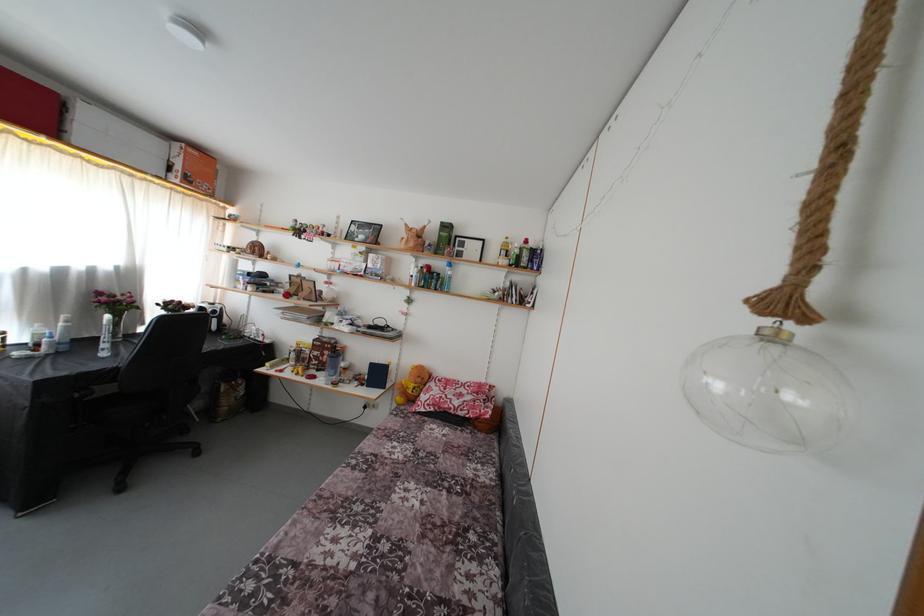
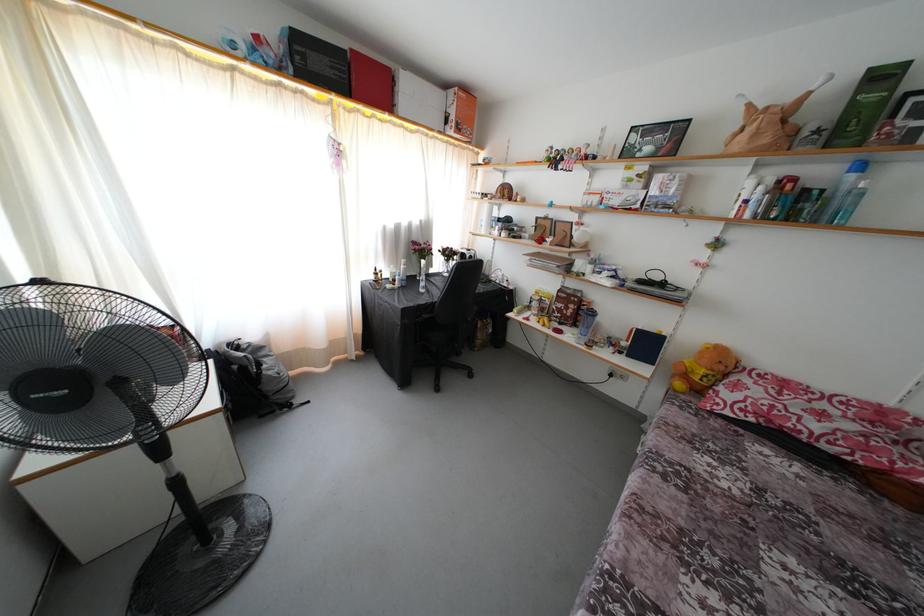
Question: The camera is either moving clockwise (left) or counter-clockwise (right) around the object. The first image is from the beginning of the video and the second image is from the end. Is the camera moving left or right when shooting the video?

Choices:
 (A) Left
 (B) Right

Answer: (B)